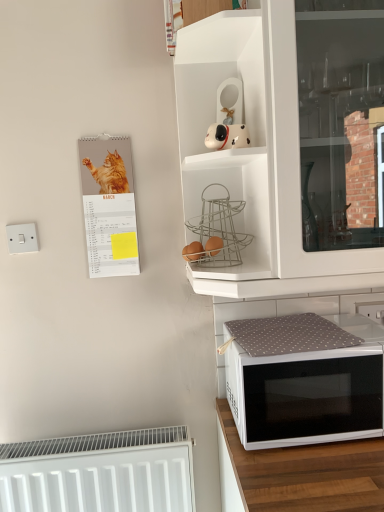
Question: Is matte paper calendar at left far away from white matte dog figurine at upper center?

Choices:
 (A) no
 (B) yes

Answer: (A)

Question: Considering the relative sizes of matte paper calendar at left and white matte dog figurine at upper center in the image provided, is matte paper calendar at left wider than white matte dog figurine at upper center?

Choices:
 (A) yes
 (B) no

Answer: (B)

Question: Is matte paper calendar at left taller than white matte dog figurine at upper center?

Choices:
 (A) yes
 (B) no

Answer: (A)

Question: From the image's perspective, is matte paper calendar at left on white matte dog figurine at upper center?

Choices:
 (A) no
 (B) yes

Answer: (A)

Question: Would you say white matte dog figurine at upper center is part of matte paper calendar at left's contents?

Choices:
 (A) no
 (B) yes

Answer: (A)

Question: In terms of height, does white plastic electric outlet at upper right look taller or shorter compared to brown matte eggs at center, the 1th food from the right?

Choices:
 (A) tall
 (B) short

Answer: (A)

Question: Is white plastic electric outlet at upper right to the left or to the right of brown matte eggs at center, the 1th food from the right, in the image?

Choices:
 (A) left
 (B) right

Answer: (B)

Question: Choose the correct answer: Is white plastic electric outlet at upper right inside brown matte eggs at center, positioned as the second food in left-to-right order, or outside it?

Choices:
 (A) outside
 (B) inside

Answer: (A)

Question: From the image's perspective, is white plastic electric outlet at upper right located above or below brown matte eggs at center, the 1th food from the right?

Choices:
 (A) below
 (B) above

Answer: (A)

Question: Is white matte cabinet at upper center in front of or behind white fabric-covered microwave at lower right in the image?

Choices:
 (A) front
 (B) behind

Answer: (B)

Question: Does point (177, 72) appear closer or farther from the camera than point (281, 437)?

Choices:
 (A) farther
 (B) closer

Answer: (A)

Question: Considering the relative positions of white matte cabinet at upper center and white fabric-covered microwave at lower right in the image provided, is white matte cabinet at upper center to the left or to the right of white fabric-covered microwave at lower right?

Choices:
 (A) left
 (B) right

Answer: (B)

Question: From the image's perspective, is white matte cabinet at upper center located above or below white fabric-covered microwave at lower right?

Choices:
 (A) above
 (B) below

Answer: (A)

Question: Based on their positions, is white fabric-covered microwave at lower right located to the left or right of white matte cabinet at upper center?

Choices:
 (A) left
 (B) right

Answer: (A)

Question: Considering the positions of point (302, 397) and point (185, 153), is point (302, 397) closer or farther from the camera than point (185, 153)?

Choices:
 (A) farther
 (B) closer

Answer: (B)